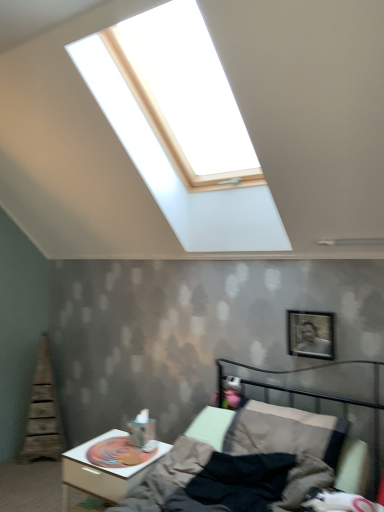
Question: Would you consider metallic silver picture frame at upper right to be distant from white glossy nightstand at lower left?

Choices:
 (A) no
 (B) yes

Answer: (B)

Question: Is metallic silver picture frame at upper right taller than white glossy nightstand at lower left?

Choices:
 (A) yes
 (B) no

Answer: (B)

Question: Considering the relative positions of metallic silver picture frame at upper right and white glossy nightstand at lower left in the image provided, is metallic silver picture frame at upper right to the left of white glossy nightstand at lower left from the viewer's perspective?

Choices:
 (A) yes
 (B) no

Answer: (B)

Question: From the image's perspective, is metallic silver picture frame at upper right located beneath white glossy nightstand at lower left?

Choices:
 (A) no
 (B) yes

Answer: (A)

Question: Is metallic silver picture frame at upper right outside white glossy nightstand at lower left?

Choices:
 (A) no
 (B) yes

Answer: (B)

Question: Is metallic gray bed at lower right situated inside white glossy nightstand at lower left or outside?

Choices:
 (A) inside
 (B) outside

Answer: (B)

Question: Looking at the image, does metallic gray bed at lower right seem bigger or smaller compared to white glossy nightstand at lower left?

Choices:
 (A) big
 (B) small

Answer: (A)

Question: In the image, is metallic gray bed at lower right positioned in front of or behind white glossy nightstand at lower left?

Choices:
 (A) behind
 (B) front

Answer: (B)

Question: From the image's perspective, is metallic gray bed at lower right above or below white glossy nightstand at lower left?

Choices:
 (A) above
 (B) below

Answer: (A)

Question: In terms of size, does metallic silver picture frame at upper right appear bigger or smaller than white glossy nightstand at lower left?

Choices:
 (A) small
 (B) big

Answer: (A)

Question: Is point (327, 349) closer or farther from the camera than point (119, 443)?

Choices:
 (A) farther
 (B) closer

Answer: (B)

Question: Is metallic silver picture frame at upper right in front of or behind white glossy nightstand at lower left in the image?

Choices:
 (A) behind
 (B) front

Answer: (A)

Question: Considering the positions of metallic silver picture frame at upper right and white glossy nightstand at lower left in the image, is metallic silver picture frame at upper right taller or shorter than white glossy nightstand at lower left?

Choices:
 (A) tall
 (B) short

Answer: (B)

Question: Looking at the image, does white glossy nightstand at lower left seem bigger or smaller compared to metallic silver picture frame at upper right?

Choices:
 (A) small
 (B) big

Answer: (B)

Question: Relative to metallic silver picture frame at upper right, is white glossy nightstand at lower left in front or behind?

Choices:
 (A) behind
 (B) front

Answer: (B)